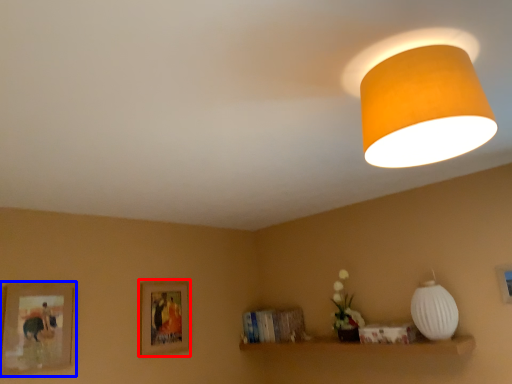
Question: Which point is closer to the camera, picture frame (highlighted by a red box) or picture frame (highlighted by a blue box)?

Choices:
 (A) picture frame
 (B) picture frame

Answer: (B)